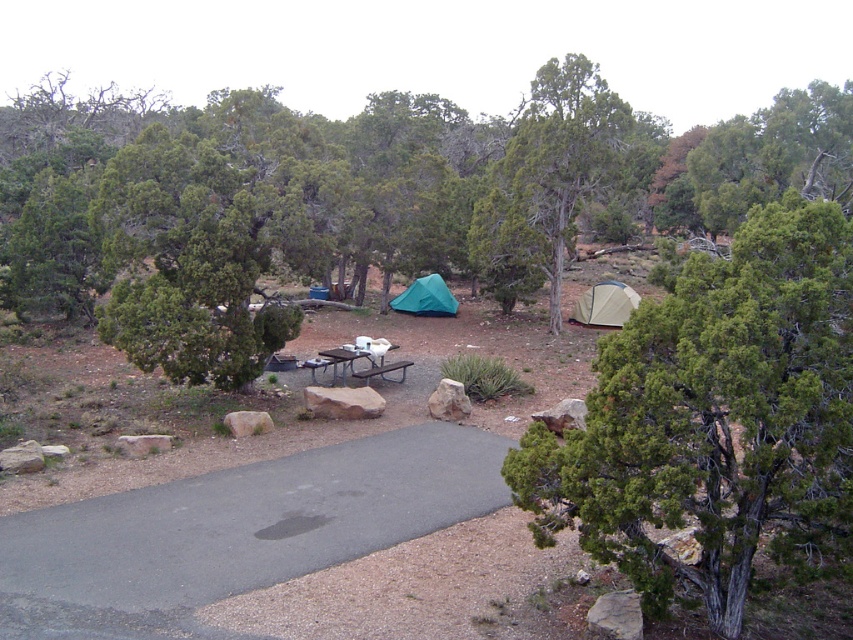
You are planning to set up a campfire between the green fabric tent at center and the brown wooden picnic table at center. Given that the recommended safe distance for a campfire is at least 20 feet from any structure, will the campfire be placed safely?

The campfire will be placed safely because the distance between the green fabric tent at center and the brown wooden picnic table at center is 25.85 feet, which exceeds the minimum required 20 feet safety distance.

You are planning to set up a tent in this camping area. You see the green textured tent at upper center and the brown metal picnic table at center. Which object is positioned higher up in the image?

The green textured tent at upper center is located above the brown metal picnic table at center in the image.

Consider the image. You are planning to set up a small campfire between the brown metal picnic table at center and the green fabric tent at center. Considering their widths, which object should you place closer to the fire to avoid it being too close to the wider object?

The green fabric tent at center is wider than the brown metal picnic table at center. To avoid placing the fire too close to the wider object, you should position the campfire closer to the brown metal picnic table at center.